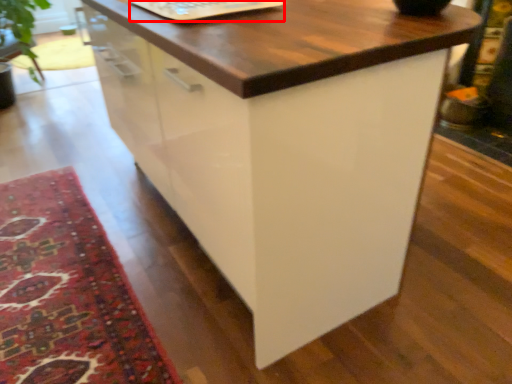
Question: Considering the relative positions of laptop keyboard (annotated by the red box) and mat in the image provided, where is laptop keyboard (annotated by the red box) located with respect to the staircase?

Choices:
 (A) right
 (B) left

Answer: (A)